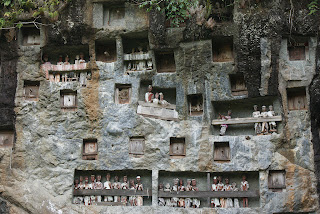
Identify the location of light blue wall. (53, 163).